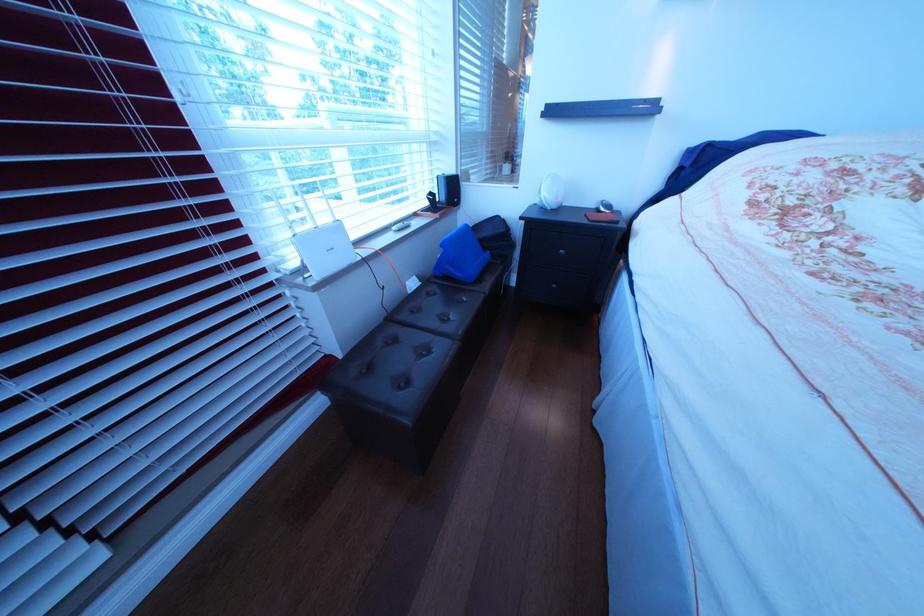
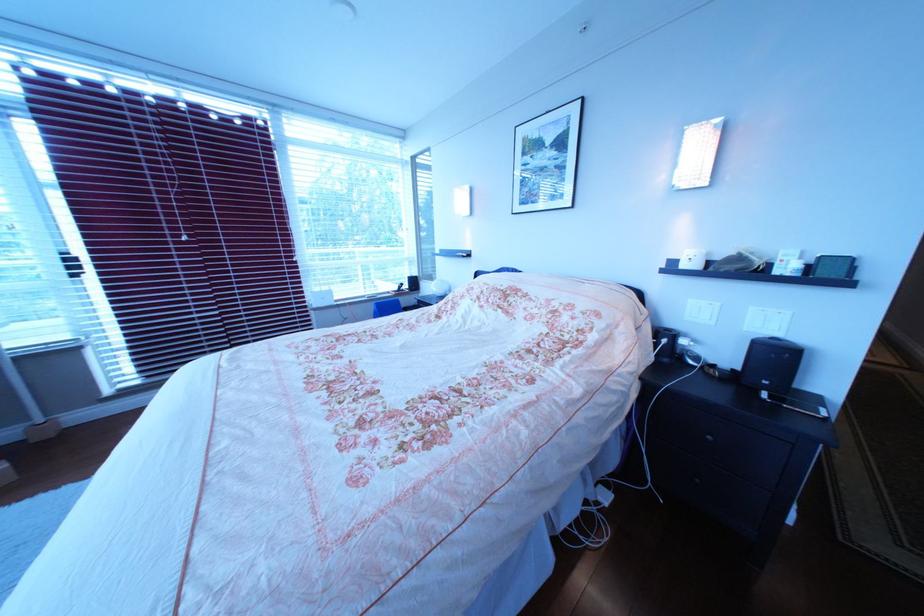
Locate, in the second image, the point that corresponds to pixel 423 228 in the first image.

(392, 299)